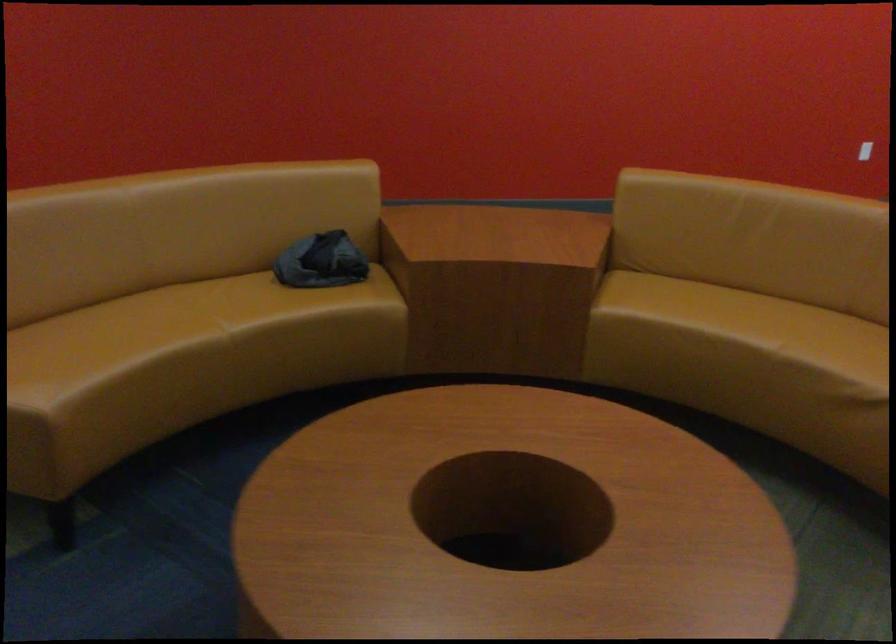
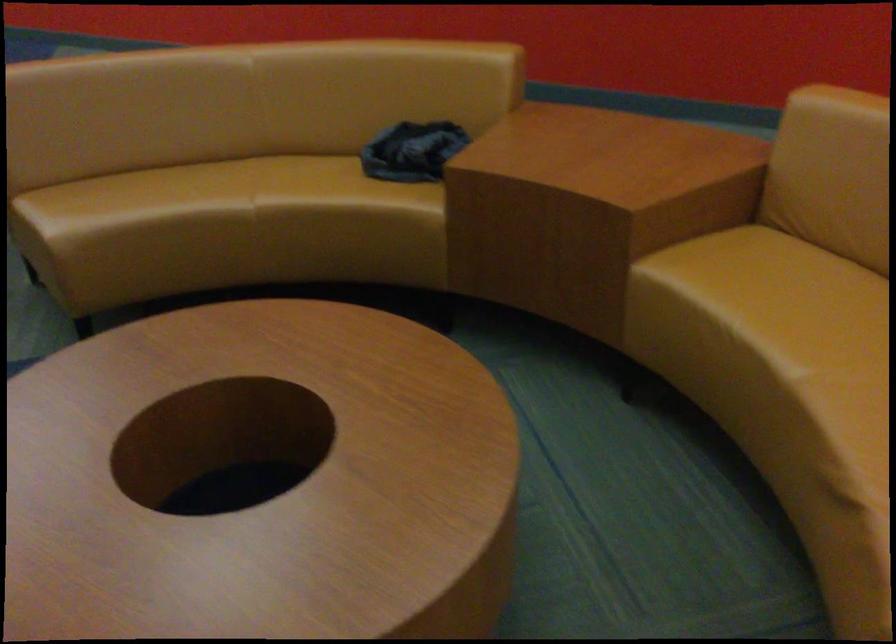
The point at (737, 310) is marked in the first image. Where is the corresponding point in the second image?

(814, 308)